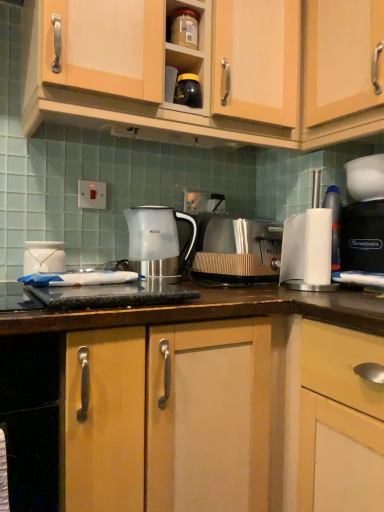
Question: Does white glossy jar at left, the 2th appliance positioned from the top, have a greater width compared to translucent plastic kettle at center?

Choices:
 (A) no
 (B) yes

Answer: (A)

Question: From the image's perspective, is white glossy jar at left, the 2th appliance positioned from the top, on translucent plastic kettle at center?

Choices:
 (A) yes
 (B) no

Answer: (B)

Question: Would you consider white glossy jar at left, which is the first appliance in bottom-to-top order, to be distant from translucent plastic kettle at center?

Choices:
 (A) yes
 (B) no

Answer: (B)

Question: Is white glossy jar at left, which is the first appliance in bottom-to-top order, surrounding translucent plastic kettle at center?

Choices:
 (A) no
 (B) yes

Answer: (A)

Question: From a real-world perspective, is white glossy jar at left, the 2th appliance positioned from the top, physically below translucent plastic kettle at center?

Choices:
 (A) no
 (B) yes

Answer: (B)

Question: From their relative heights in the image, would you say white paper towel at right is taller or shorter than black glossy jar at upper center, placed as the first appliance when sorted from right to left?

Choices:
 (A) short
 (B) tall

Answer: (B)

Question: Looking at the image, does white paper towel at right seem bigger or smaller compared to black glossy jar at upper center, the first appliance in the top-to-bottom sequence?

Choices:
 (A) big
 (B) small

Answer: (A)

Question: Considering the relative positions of white paper towel at right and black glossy jar at upper center, the first appliance in the top-to-bottom sequence, in the image provided, is white paper towel at right to the left or to the right of black glossy jar at upper center, the first appliance in the top-to-bottom sequence,?

Choices:
 (A) left
 (B) right

Answer: (B)

Question: Relative to black glossy jar at upper center, which is the second appliance in bottom-to-top order, is white paper towel at right in front or behind?

Choices:
 (A) behind
 (B) front

Answer: (A)

Question: Is white paper towel at right wider or thinner than white glossy jar at left, the 1th appliance positioned from the left?

Choices:
 (A) wide
 (B) thin

Answer: (B)

Question: From the image's perspective, is white paper towel at right located above or below white glossy jar at left, the 1th appliance positioned from the left?

Choices:
 (A) below
 (B) above

Answer: (B)

Question: In the image, is white paper towel at right positioned in front of or behind white glossy jar at left, the 1th appliance positioned from the left?

Choices:
 (A) front
 (B) behind

Answer: (B)

Question: From a real-world perspective, is white paper towel at right above or below white glossy jar at left, the 2th appliance positioned from the top?

Choices:
 (A) above
 (B) below

Answer: (A)

Question: Considering the positions of white glossy jar at left, the second appliance when ordered from right to left, and white paper towel at right in the image, is white glossy jar at left, the second appliance when ordered from right to left, wider or thinner than white paper towel at right?

Choices:
 (A) wide
 (B) thin

Answer: (A)

Question: From a real-world perspective, is white glossy jar at left, which is the first appliance in bottom-to-top order, positioned above or below white paper towel at right?

Choices:
 (A) below
 (B) above

Answer: (A)